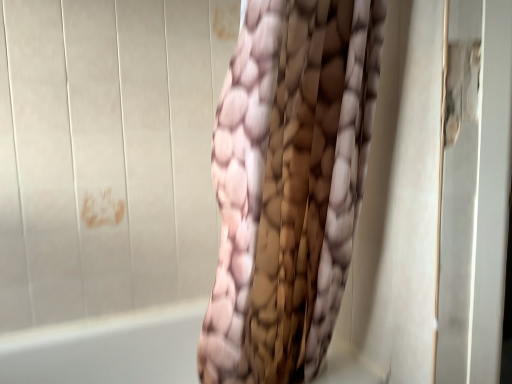
Measure the distance between point [301,294] and camera.

They are 3.53 feet apart.

Where is `pink fabric curtain at center`? pink fabric curtain at center is located at coordinates (289, 184).

The height and width of the screenshot is (384, 512). What do you see at coordinates (289, 184) in the screenshot?
I see `pink fabric curtain at center` at bounding box center [289, 184].

In order to face pink fabric curtain at center, should I rotate leftwards or rightwards?

It's best to rotate right around 4.998 degrees.

Locate an element on the screen. Image resolution: width=512 pixels, height=384 pixels. pink fabric curtain at center is located at coordinates (289, 184).